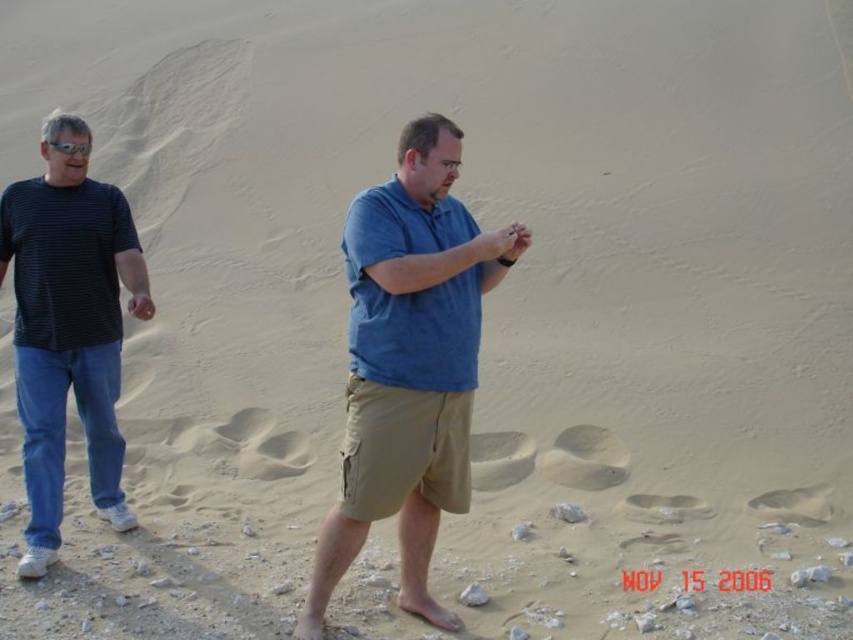
You are standing at the point with coordinates point (97, 230) and want to walk towards the point (343, 548). Given the sandy terrain described, will you have to walk uphill or downhill?

Since point (343, 548) is in front of point (97, 230), you will be walking uphill as you move towards it.

You are a photographer trying to capture both the khaki shorts at center and the dark blue striped shirt at left in the same frame. Based on their positions, which direction should you move your camera to include both subjects?

The khaki shorts at center is positioned on the right side of dark blue striped shirt at left. To include both in the frame, you should move your camera to the left to capture the dark blue striped shirt at left and then pan towards the right to include the khaki shorts at center.

You are standing at the location of the viewer and want to throw a ball to the khaki shorts at center. Is the distance within a typical adult human throwing range?

The khaki shorts at center and viewer are 4.54 meters apart. A typical adult can throw a ball about 20 meters, so yes, the distance is within range.